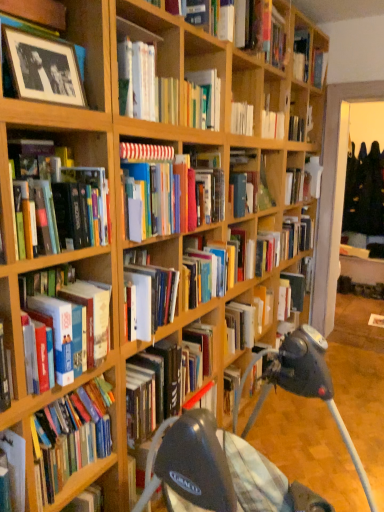
What do you see at coordinates (296, 185) in the screenshot? I see `hardcover book at center, the fifth book positioned from the top` at bounding box center [296, 185].

You are a GUI agent. You are given a task and a screenshot of the screen. Output one action in this format:
    pyautogui.click(x=<x>, y=<y>)
    Task: Click on the black matte photo frame at upper left, arranged as the 4th book when viewed from the top
    This screenshot has width=384, height=512.
    Given the screenshot: What is the action you would take?
    pyautogui.click(x=41, y=65)

Locate an element on the screen. Image resolution: width=384 pixels, height=512 pixels. hardcover books at left, the 5th book when ordered from bottom to top is located at coordinates (64, 197).

What is the approximate height of black plastic baby carriage at center?

It is 2.15 inches.

This screenshot has width=384, height=512. Describe the element at coordinates (145, 85) in the screenshot. I see `hardcover books at center, which is the third book from top to bottom` at that location.

The width and height of the screenshot is (384, 512). In order to click on hardcover book at center, the eleventh book when ordered from top to bottom in this screenshot , I will do `click(296, 289)`.

Is hardcover book at upper center, which appears as the 1th book when viewed from the top, to the right of hardcover book at center, the twelfth book viewed from the top, from the viewer's perspective?

Yes.

In the scene shown: How distant is hardcover book at upper center, the 13th book ordered from the bottom, from hardcover book at center, the twelfth book viewed from the top?

hardcover book at upper center, the 13th book ordered from the bottom, is 5.41 feet away from hardcover book at center, the twelfth book viewed from the top.

Is hardcover book at upper center, which appears as the 1th book when viewed from the top, next to hardcover book at center, the 2th book ordered from the bottom, and touching it?

No, hardcover book at upper center, which appears as the 1th book when viewed from the top, is not with hardcover book at center, the 2th book ordered from the bottom.

Is hardcover book at upper center, which appears as the 1th book when viewed from the top, facing away from hardcover book at center, the 2th book ordered from the bottom?

That's not correct — hardcover book at upper center, which appears as the 1th book when viewed from the top, is not looking away from hardcover book at center, the 2th book ordered from the bottom.

How different are the orientations of hardcover books at left, the 5th book when ordered from bottom to top, and hardcover book at center, which is counted as the eighth book, starting from the bottom, in degrees?

The facing directions of hardcover books at left, the 5th book when ordered from bottom to top, and hardcover book at center, which is counted as the eighth book, starting from the bottom, are 8.38 degrees apart.

Is hardcover books at left, the 9th book viewed from the top, spatially inside hardcover book at center, which is counted as the eighth book, starting from the bottom, or outside of it?

hardcover books at left, the 9th book viewed from the top, is located beyond the bounds of hardcover book at center, which is counted as the eighth book, starting from the bottom.

Is hardcover books at left, the 5th book when ordered from bottom to top, oriented away from hardcover book at center, acting as the sixth book starting from the top?

hardcover books at left, the 5th book when ordered from bottom to top, is not turned away from hardcover book at center, acting as the sixth book starting from the top.

Does black plastic baby carriage at center have a smaller size compared to hardcover book at center, the fifth book positioned from the top?

Actually, black plastic baby carriage at center might be larger than hardcover book at center, the fifth book positioned from the top.

Is black plastic baby carriage at center not within hardcover book at center, the fifth book positioned from the top?

Yes, black plastic baby carriage at center is not within hardcover book at center, the fifth book positioned from the top.

From the image's perspective, is black plastic baby carriage at center positioned above or below hardcover book at center, the ninth book positioned from the bottom?

From the image's perspective, black plastic baby carriage at center appears below hardcover book at center, the ninth book positioned from the bottom.

Is black matte photo frame at upper left, placed as the tenth book when sorted from bottom to top, taller than hardcover book at center, acting as the sixth book starting from the top?

Incorrect, the height of black matte photo frame at upper left, placed as the tenth book when sorted from bottom to top, is not larger of that of hardcover book at center, acting as the sixth book starting from the top.

From a real-world perspective, is black matte photo frame at upper left, arranged as the 4th book when viewed from the top, on top of hardcover book at center, acting as the sixth book starting from the top?

Yes, from a real-world perspective, black matte photo frame at upper left, arranged as the 4th book when viewed from the top, is on top of hardcover book at center, acting as the sixth book starting from the top.

How many degrees apart are the facing directions of black matte photo frame at upper left, arranged as the 4th book when viewed from the top, and hardcover book at center, acting as the sixth book starting from the top?

8.37 degrees.

Are black matte photo frame at upper left, placed as the tenth book when sorted from bottom to top, and hardcover book at center, which is counted as the eighth book, starting from the bottom, beside each other?

black matte photo frame at upper left, placed as the tenth book when sorted from bottom to top, is not next to hardcover book at center, which is counted as the eighth book, starting from the bottom, and they're not touching.

Which object is closer to the camera, hardcover book at center, the 6th book when ordered from bottom to top, or hardcover book at upper center, which is the second book from top to bottom?

Result: hardcover book at upper center, which is the second book from top to bottom.

Is hardcover book at center, acting as the 8th book starting from the top, completely or partially outside of hardcover book at upper center, which is the second book from top to bottom?

Yes, hardcover book at center, acting as the 8th book starting from the top, is located beyond the bounds of hardcover book at upper center, which is the second book from top to bottom.

From the image's perspective, which is above, hardcover book at center, the 6th book when ordered from bottom to top, or hardcover book at upper center, which is the second book from top to bottom?

hardcover book at upper center, which is the second book from top to bottom, is shown above in the image.

Between multicolored hardcover books at center, arranged as the 7th book when viewed from the top, and hardcover book at upper center, which is the second book from top to bottom, which one has larger size?

With larger size is hardcover book at upper center, which is the second book from top to bottom.

Is multicolored hardcover books at center, marked as the 7th book in a bottom-to-top arrangement, inside the boundaries of hardcover book at upper center, which is the second book from top to bottom, or outside?

multicolored hardcover books at center, marked as the 7th book in a bottom-to-top arrangement, is spatially situated outside hardcover book at upper center, which is the second book from top to bottom.

Locate an element on the screen. book that is the 1st one when counting backward from the multicolored hardcover books at center, arranged as the 7th book when viewed from the top is located at coordinates (260, 30).

In the scene shown: Is multicolored hardcover books at center, arranged as the 7th book when viewed from the top, aimed at hardcover book at upper center, which is the 12th book from bottom to top?

No, multicolored hardcover books at center, arranged as the 7th book when viewed from the top, is not turned towards hardcover book at upper center, which is the 12th book from bottom to top.

Is multicolored hardcover books at center, arranged as the 7th book when viewed from the top, at the right side of black matte photo frame at upper left, placed as the tenth book when sorted from bottom to top?

Yes, multicolored hardcover books at center, arranged as the 7th book when viewed from the top, is to the right of black matte photo frame at upper left, placed as the tenth book when sorted from bottom to top.

Identify the location of the 3rd book above the multicolored hardcover books at center, arranged as the 7th book when viewed from the top (from the image's perspective). This screenshot has width=384, height=512. pos(41,65).

From a real-world perspective, is multicolored hardcover books at center, arranged as the 7th book when viewed from the top, located beneath black matte photo frame at upper left, arranged as the 4th book when viewed from the top?

Yes, from a real-world perspective, multicolored hardcover books at center, arranged as the 7th book when viewed from the top, is below black matte photo frame at upper left, arranged as the 4th book when viewed from the top.

How distant is multicolored hardcover books at center, marked as the 7th book in a bottom-to-top arrangement, from black matte photo frame at upper left, arranged as the 4th book when viewed from the top?

multicolored hardcover books at center, marked as the 7th book in a bottom-to-top arrangement, and black matte photo frame at upper left, arranged as the 4th book when viewed from the top, are 16.87 inches apart.

Identify the location of book that is the 2nd object located in front of the hardcover book at upper center, the 13th book ordered from the bottom. The image size is (384, 512). (254, 315).

At what (x,y) coordinates should I click in order to perform the action: click on the 7th book to the left when counting from the hardcover book at center, which is counted as the eighth book, starting from the bottom. Please return your answer as a coordinate pair (x, y). Image resolution: width=384 pixels, height=512 pixels. Looking at the image, I should click on 64,197.

Based on their spatial positions, is hardcover book at center, the eleventh book when ordered from top to bottom, or hardcover book at center, the twelfth book viewed from the top, further from black plastic baby carriage at center?

Based on the image, hardcover book at center, the eleventh book when ordered from top to bottom, appears to be further to black plastic baby carriage at center.

When comparing their distances from hardcover book at center, the 2th book ordered from the bottom, does hardcover book at center, the ninth book positioned from the bottom, or hardcover book at left, positioned as the thirteenth book in top-to-bottom order, seem further?

Among the two, hardcover book at left, positioned as the thirteenth book in top-to-bottom order, is located further to hardcover book at center, the 2th book ordered from the bottom.

Looking at this image, which object lies nearer to the anchor point black matte photo frame at upper left, arranged as the 4th book when viewed from the top, hardcover book at upper center, which appears as the 1th book when viewed from the top, or wooden bookshelf at lower left?

wooden bookshelf at lower left lies closer to black matte photo frame at upper left, arranged as the 4th book when viewed from the top, than the other object.

When comparing their distances from hardcover book at upper center, which appears as the 1th book when viewed from the top, does hardcover book at center, the 2th book ordered from the bottom, or hardcover book at center, which is counted as the 3th book, starting from the bottom, seem further?

hardcover book at center, the 2th book ordered from the bottom, is positioned further to the anchor hardcover book at upper center, which appears as the 1th book when viewed from the top.

Estimate the real-world distances between objects in this image. Which object is further from hardcover book at center, which is counted as the eighth book, starting from the bottom, black plastic baby carriage at center or wooden bookshelf at lower left?

wooden bookshelf at lower left.

Considering their positions, is black matte photo frame at upper left, placed as the tenth book when sorted from bottom to top, positioned further to hardcover book at center, the ninth book positioned from the bottom, than hardcover books at left, the 9th book viewed from the top?

Among the two, black matte photo frame at upper left, placed as the tenth book when sorted from bottom to top, is located further to hardcover book at center, the ninth book positioned from the bottom.

In the scene shown: Based on their spatial positions, is black plastic baby carriage at center or hardcover book at upper center, which appears as the 1th book when viewed from the top, closer to black matte photo frame at upper left, placed as the tenth book when sorted from bottom to top?

black plastic baby carriage at center is positioned closer to the anchor black matte photo frame at upper left, placed as the tenth book when sorted from bottom to top.

Based on their spatial positions, is hardcover book at upper center, which is the second book from top to bottom, or hardcover books at left, the 5th book when ordered from bottom to top, closer to hardcover books at center, which is the third book from top to bottom?

Among the two, hardcover books at left, the 5th book when ordered from bottom to top, is located nearer to hardcover books at center, which is the third book from top to bottom.

Where is `baby carriage located between hardcover books at left, the 9th book viewed from the top, and hardcover book at center, the twelfth book viewed from the top, in the depth direction`? This screenshot has height=512, width=384. baby carriage located between hardcover books at left, the 9th book viewed from the top, and hardcover book at center, the twelfth book viewed from the top, in the depth direction is located at coordinates (244, 445).

I want to click on shelf between black matte photo frame at upper left, placed as the tenth book when sorted from bottom to top, and hardcover book at center, the 2th book ordered from the bottom, along the z-axis, so click(82, 481).

Find the location of a particular element. This screenshot has height=512, width=384. baby carriage between hardcover book at center, the fifth book positioned from the top, and wooden bookshelf at lower left, in the vertical direction is located at coordinates (244, 445).

Where is `shelf located between black plastic baby carriage at center and hardcover book at center, the 2th book ordered from the bottom, in the depth direction`? shelf located between black plastic baby carriage at center and hardcover book at center, the 2th book ordered from the bottom, in the depth direction is located at coordinates (82, 481).